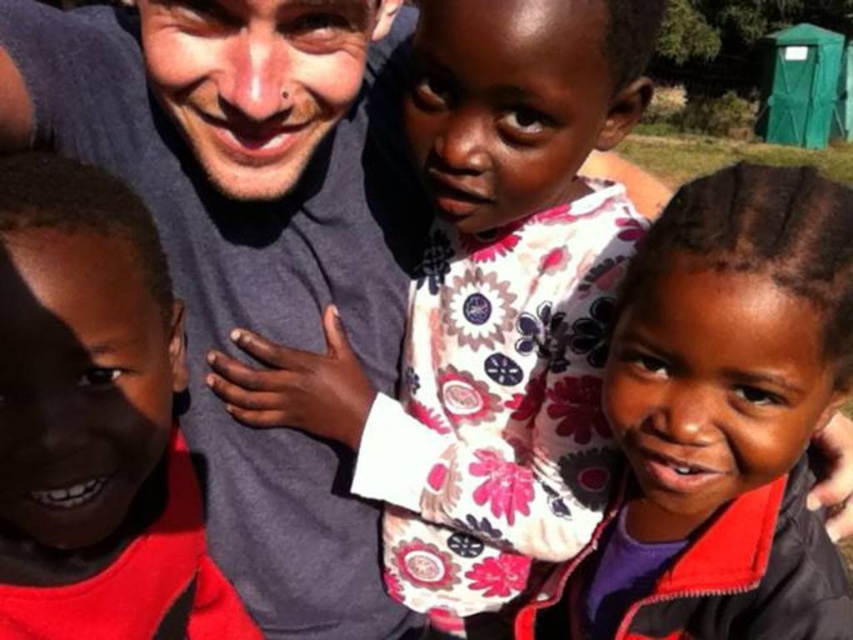
Question: Which of the following is the farthest from the observer?

Choices:
 (A) matte floral dress at center
 (B) matte red shirt at left

Answer: (A)

Question: From the image, what is the correct spatial relationship of matte floral dress at center in relation to matte red shirt at left?

Choices:
 (A) right
 (B) left

Answer: (A)

Question: Observing the image, what is the correct spatial positioning of matte floral dress at center in reference to matte red shirt at left?

Choices:
 (A) left
 (B) right

Answer: (B)

Question: Which of the following is the closest to the observer?

Choices:
 (A) pyautogui.click(x=171, y=486)
 (B) pyautogui.click(x=737, y=492)

Answer: (B)

Question: Can you confirm if matte floral dress at center is positioned above matte red shirt at left?

Choices:
 (A) no
 (B) yes

Answer: (A)

Question: Which point is farther from the camera taking this photo?

Choices:
 (A) (59, 182)
 (B) (833, 182)

Answer: (B)